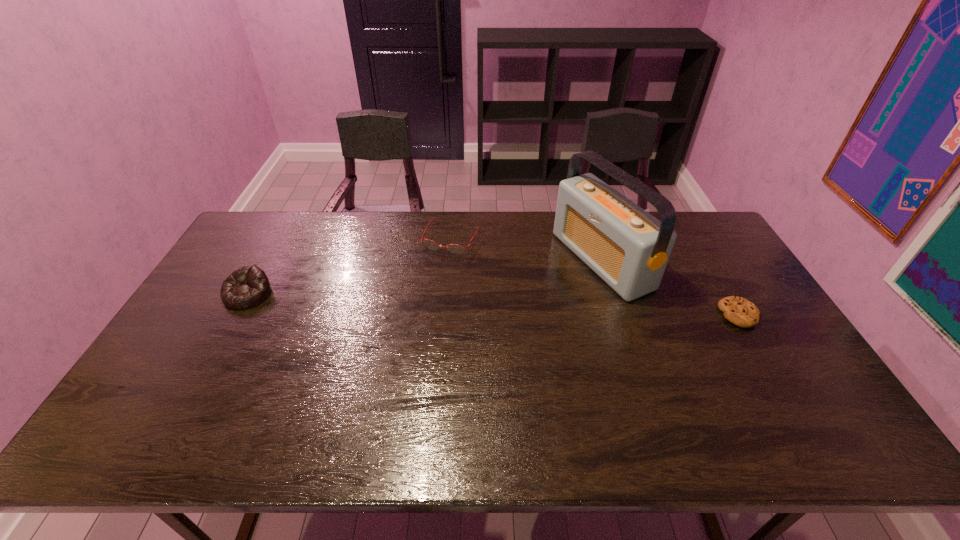
Where is `free region located on the front-facing side of the radio receiver`? This screenshot has width=960, height=540. free region located on the front-facing side of the radio receiver is located at coordinates (484, 310).

The height and width of the screenshot is (540, 960). I want to click on free location located 0.360m on the front-facing side of the radio receiver, so 466,318.

Identify the location of blank space located on the front-facing side of the radio receiver. Image resolution: width=960 pixels, height=540 pixels. click(468, 316).

Find the location of a particular element. vacant space situated 0.220m on the lenses of the spectacles is located at coordinates (419, 299).

You are a GUI agent. You are given a task and a screenshot of the screen. Output one action in this format:
    pyautogui.click(x=<x>, y=<y>)
    Task: Click on the vacant space situated 0.080m on the lenses of the spectacles
    Image resolution: width=960 pixels, height=540 pixels.
    Given the screenshot: What is the action you would take?
    pyautogui.click(x=434, y=269)

The height and width of the screenshot is (540, 960). Find the location of `vacant region located 0.340m on the lenses of the spectacles`. vacant region located 0.340m on the lenses of the spectacles is located at coordinates (403, 327).

Image resolution: width=960 pixels, height=540 pixels. What are the coordinates of `radio receiver located at the far edge` in the screenshot? It's located at (628, 248).

Where is `spectacles that is at the far edge`? The width and height of the screenshot is (960, 540). spectacles that is at the far edge is located at coordinates (453, 248).

Locate an element on the screen. Image resolution: width=960 pixels, height=540 pixels. object present at the left edge is located at coordinates (248, 286).

Find the location of a particular element. The width and height of the screenshot is (960, 540). object that is at the right edge is located at coordinates (737, 310).